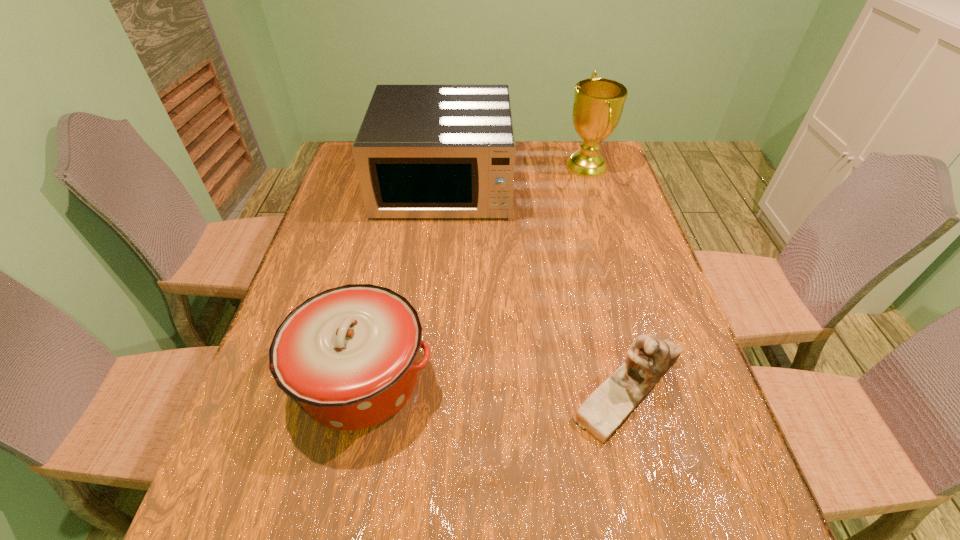
In the image, there is a desktop. Identify the location of vacant region at the far edge. (526, 175).

Where is `free spot at the near edge of the desktop`? free spot at the near edge of the desktop is located at coordinates (405, 527).

In the image, there is a desktop. Where is `free region at the left edge`? free region at the left edge is located at coordinates tap(348, 262).

Where is `vacant point at the right edge`? vacant point at the right edge is located at coordinates (625, 193).

This screenshot has width=960, height=540. I want to click on vacant space at the far right corner of the desktop, so click(615, 166).

This screenshot has width=960, height=540. What are the coordinates of `vacant point located between the shortest object and the second shortest object` in the screenshot? It's located at (x=494, y=383).

The height and width of the screenshot is (540, 960). What are the coordinates of `free space between the casserole and the shortest object` in the screenshot? It's located at (494, 383).

This screenshot has height=540, width=960. Identify the location of free space between the shortest object and the microwave oven. (536, 286).

I want to click on free space that is in between the microwave oven and the figurine, so click(x=536, y=286).

Locate an element on the screen. This screenshot has width=960, height=540. free space between the microwave oven and the figurine is located at coordinates (536, 286).